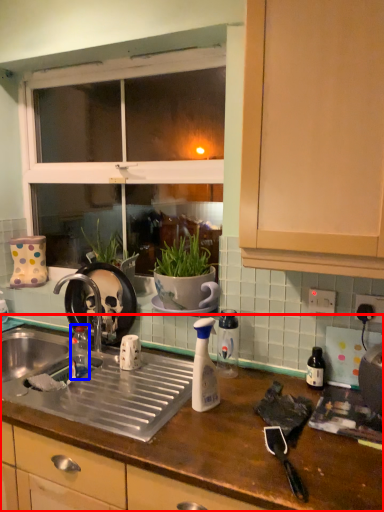
Question: Which object appears farthest to the camera in this image, countertop (highlighted by a red box) or bottle (highlighted by a blue box)?

Choices:
 (A) countertop
 (B) bottle

Answer: (B)